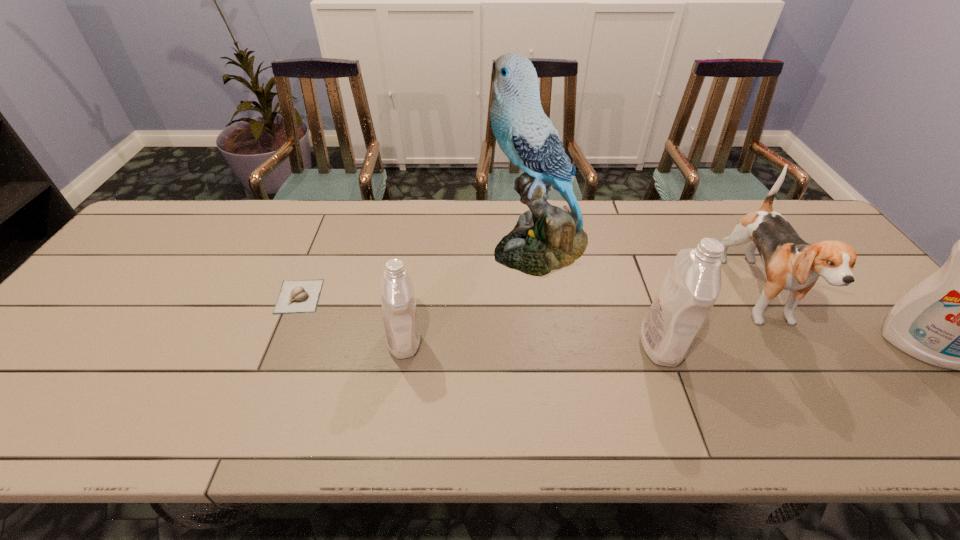
Find the location of a particular element. The height and width of the screenshot is (540, 960). detergent that stands as the closest to the leftmost object is located at coordinates (402, 336).

Where is `detergent that stands as the closest to the fifth shortest object`? The image size is (960, 540). detergent that stands as the closest to the fifth shortest object is located at coordinates (692, 284).

Locate an element on the screen. vacant area that satisfies the following two spatial constraints: 1. on the face of the third object from left to right; 2. on the left side of the second shortest detergent is located at coordinates (553, 344).

Find the location of `free space in the image that satisfies the following two spatial constraints: 1. on the front side of the garlic; 2. on the right side of the leftmost detergent`. free space in the image that satisfies the following two spatial constraints: 1. on the front side of the garlic; 2. on the right side of the leftmost detergent is located at coordinates (281, 341).